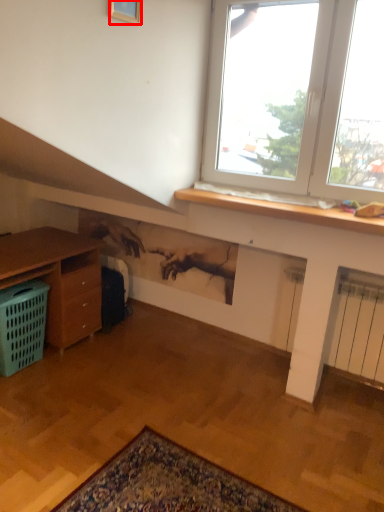
Question: From the image's perspective, what is the correct spatial relationship of picture frame (annotated by the red box) in relation to basket?

Choices:
 (A) above
 (B) below

Answer: (A)